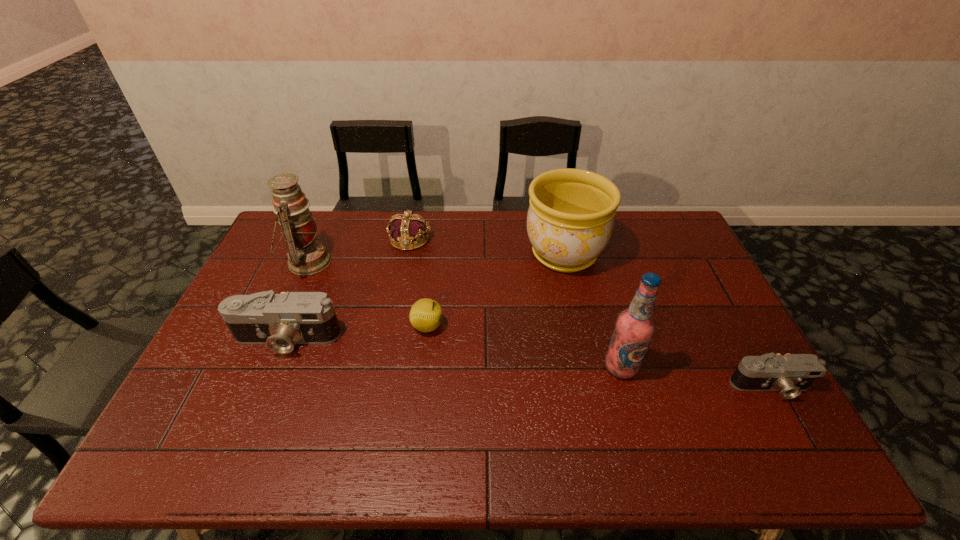
Where is `location for an additional camera to make spacing equal`? Image resolution: width=960 pixels, height=540 pixels. location for an additional camera to make spacing equal is located at coordinates (517, 362).